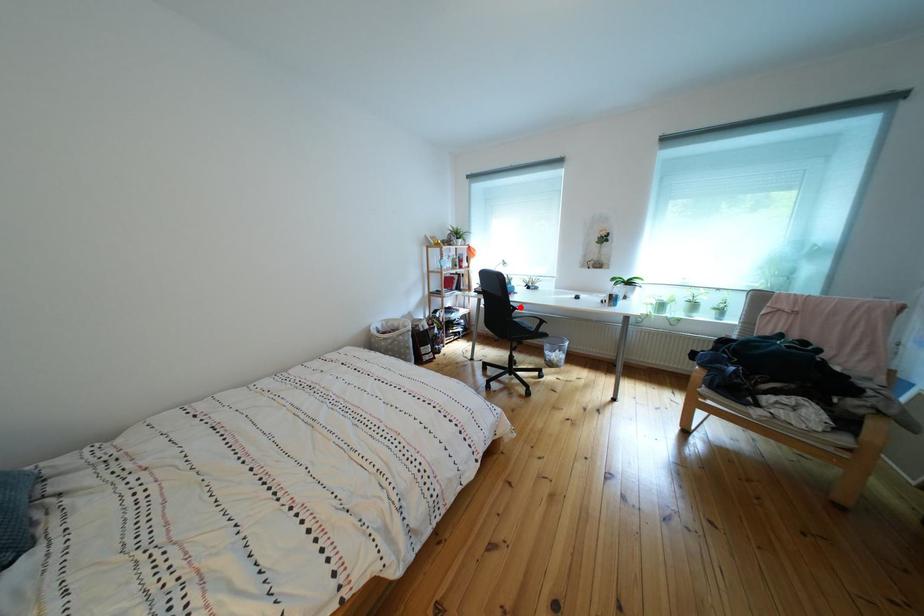
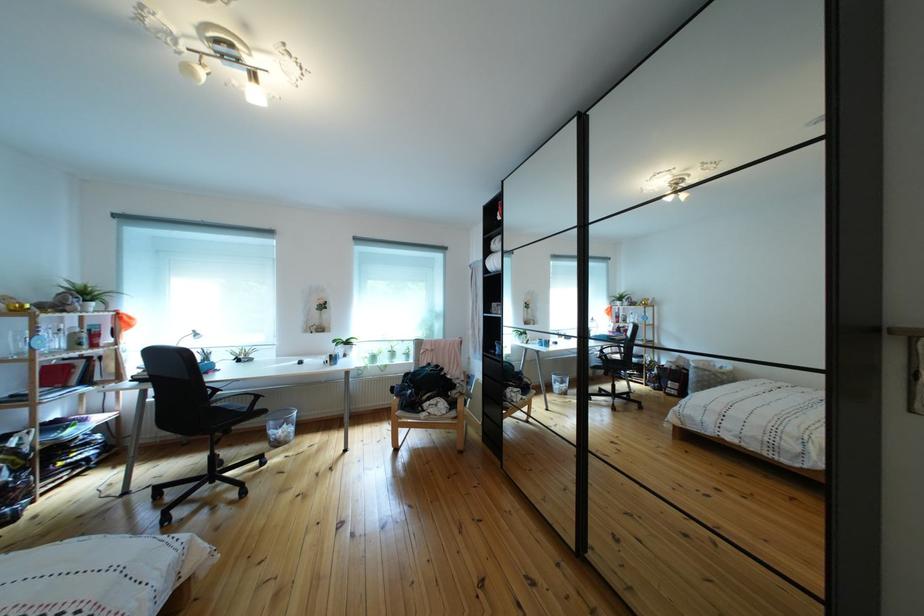
Where in the second image is the point corresponding to the highlighted location from the first image?

(214, 389)